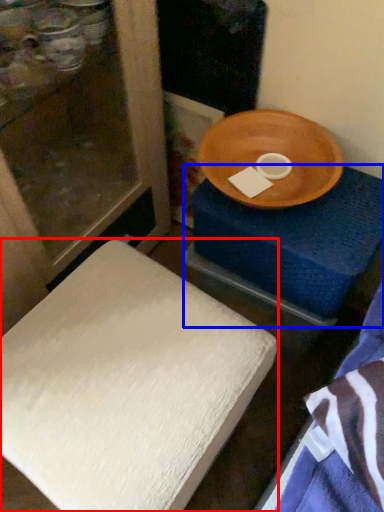
Question: Which point is closer to the camera, furniture (highlighted by a red box) or changing table (highlighted by a blue box)?

Choices:
 (A) furniture
 (B) changing table

Answer: (A)